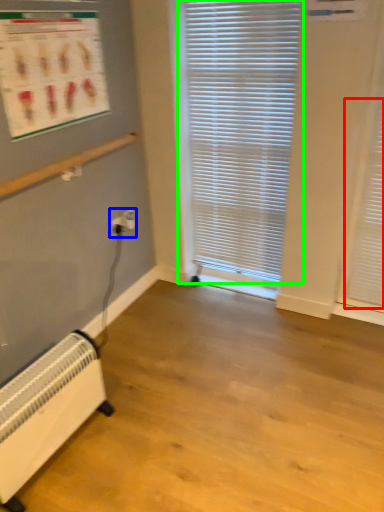
Question: Considering the real-world distances, which object is farthest from shutter (highlighted by a red box)? electric outlet (highlighted by a blue box) or window blind (highlighted by a green box)?

Choices:
 (A) electric outlet
 (B) window blind

Answer: (A)